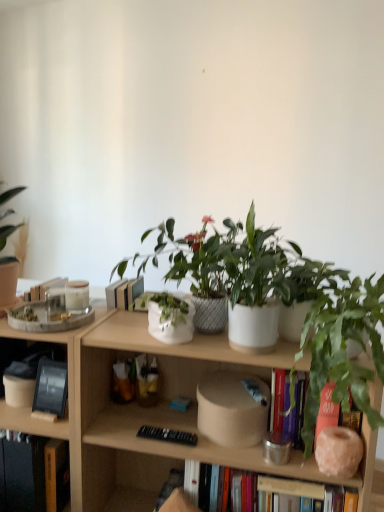
Where is `vacant point above wooden bookcase at center (from a real-world perspective)`? vacant point above wooden bookcase at center (from a real-world perspective) is located at coordinates (143, 331).